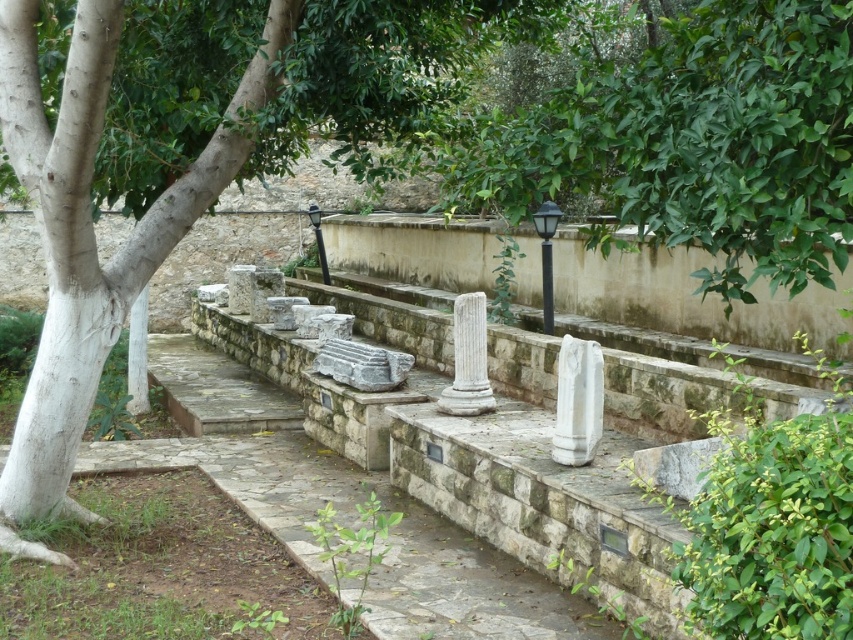
Based on the photo, you are an archaeologist examining the site. You notice the white marble column at center and the white marble pillar at lower left. Which one is larger in size?

The white marble pillar at lower left is larger in size compared to the white marble column at center.